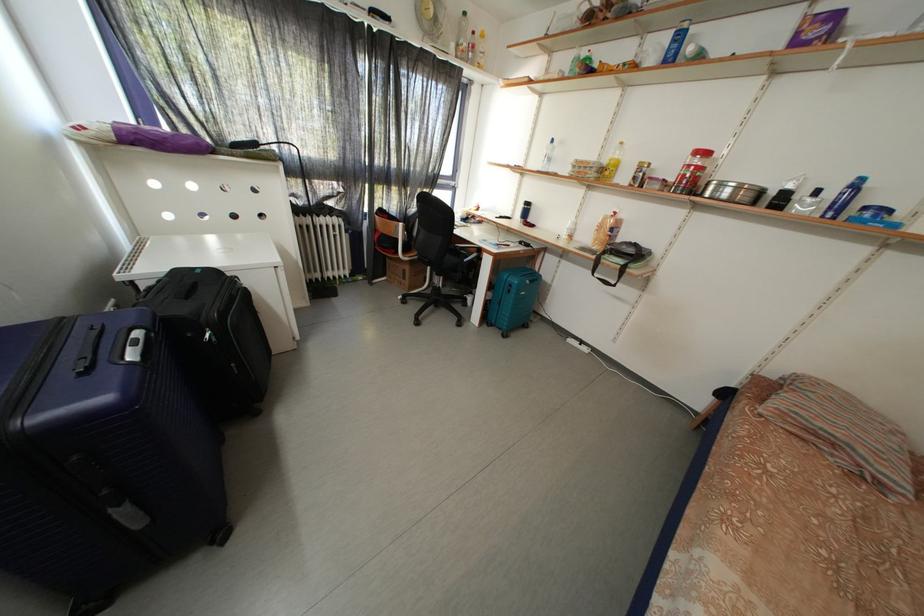
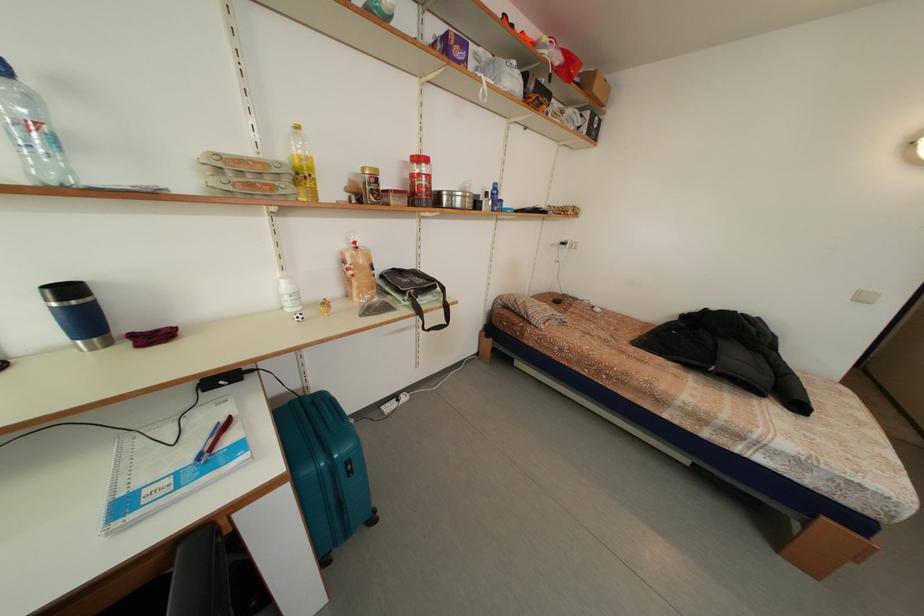
The point at (562, 155) is marked in the first image. Where is the corresponding point in the second image?

(40, 106)